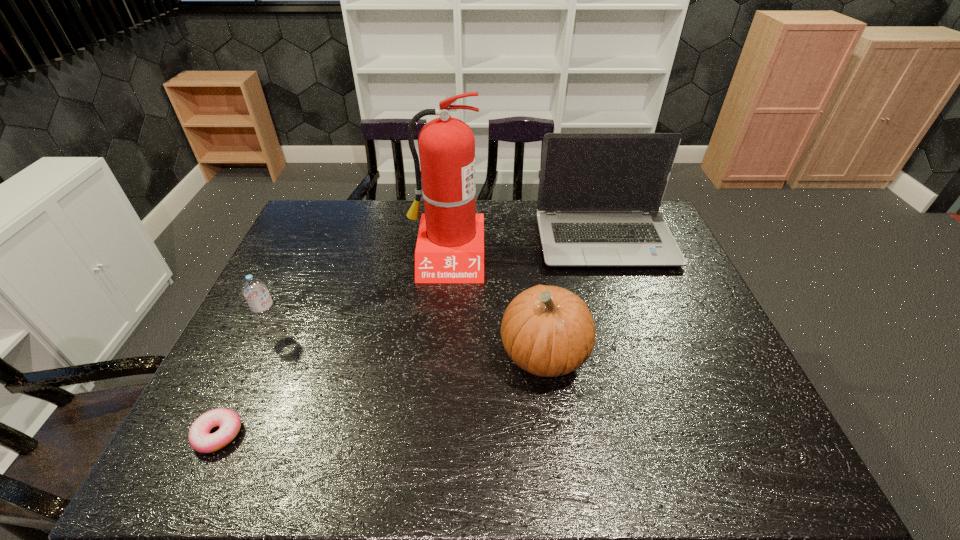
Identify the location of empty space that is in between the fourth tallest object and the shortest object. (246, 383).

In order to click on unoccupied position between the third shortest object and the fire extinguisher in this screenshot , I will do `click(495, 305)`.

You are a GUI agent. You are given a task and a screenshot of the screen. Output one action in this format:
    pyautogui.click(x=<x>, y=<y>)
    Task: Click on the vacant area between the pumpkin and the tallest object
    
    Given the screenshot: What is the action you would take?
    pyautogui.click(x=495, y=305)

Find the location of a particular element. vacant space in between the fire extinguisher and the second shortest object is located at coordinates [361, 294].

You are a GUI agent. You are given a task and a screenshot of the screen. Output one action in this format:
    pyautogui.click(x=<x>, y=<y>)
    Task: Click on the object that can be found as the third closest to the third tallest object
    
    Given the screenshot: What is the action you would take?
    pyautogui.click(x=255, y=291)

The image size is (960, 540). I want to click on object identified as the third closest to the fire extinguisher, so 255,291.